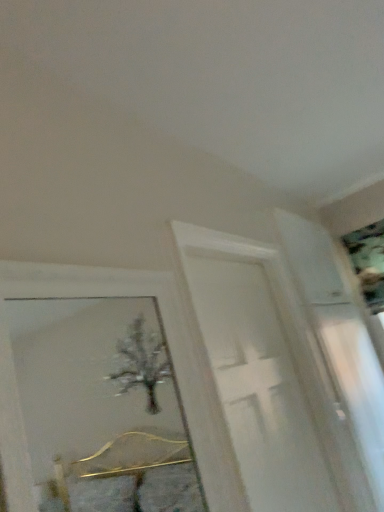
Question: Would you say metallic silver picture frame at upper right is a long distance from white glossy screen door at center?

Choices:
 (A) no
 (B) yes

Answer: (B)

Question: From the image's perspective, would you say metallic silver picture frame at upper right is shown under white glossy screen door at center?

Choices:
 (A) yes
 (B) no

Answer: (B)

Question: Can you confirm if metallic silver picture frame at upper right is thinner than white glossy screen door at center?

Choices:
 (A) no
 (B) yes

Answer: (A)

Question: From a real-world perspective, is metallic silver picture frame at upper right physically below white glossy screen door at center?

Choices:
 (A) yes
 (B) no

Answer: (B)

Question: From the image's perspective, is metallic silver picture frame at upper right above white glossy screen door at center?

Choices:
 (A) yes
 (B) no

Answer: (A)

Question: From a real-world perspective, is metallic silver picture frame at upper right on top of white glossy screen door at center?

Choices:
 (A) yes
 (B) no

Answer: (A)

Question: Considering the relative sizes of white glossy screen door at center and metallic silver picture frame at upper right in the image provided, is white glossy screen door at center wider than metallic silver picture frame at upper right?

Choices:
 (A) yes
 (B) no

Answer: (B)

Question: Is white glossy screen door at center facing away from metallic silver picture frame at upper right?

Choices:
 (A) no
 (B) yes

Answer: (A)

Question: Does white glossy screen door at center touch metallic silver picture frame at upper right?

Choices:
 (A) no
 (B) yes

Answer: (A)

Question: From the image's perspective, does white glossy screen door at center appear higher than metallic silver picture frame at upper right?

Choices:
 (A) yes
 (B) no

Answer: (B)

Question: Does white glossy screen door at center have a lesser width compared to metallic silver picture frame at upper right?

Choices:
 (A) yes
 (B) no

Answer: (A)

Question: Is white glossy screen door at center far away from metallic silver picture frame at upper right?

Choices:
 (A) no
 (B) yes

Answer: (B)

Question: In the image, is white glossy screen door at center on the left side or the right side of metallic silver picture frame at upper right?

Choices:
 (A) right
 (B) left

Answer: (B)